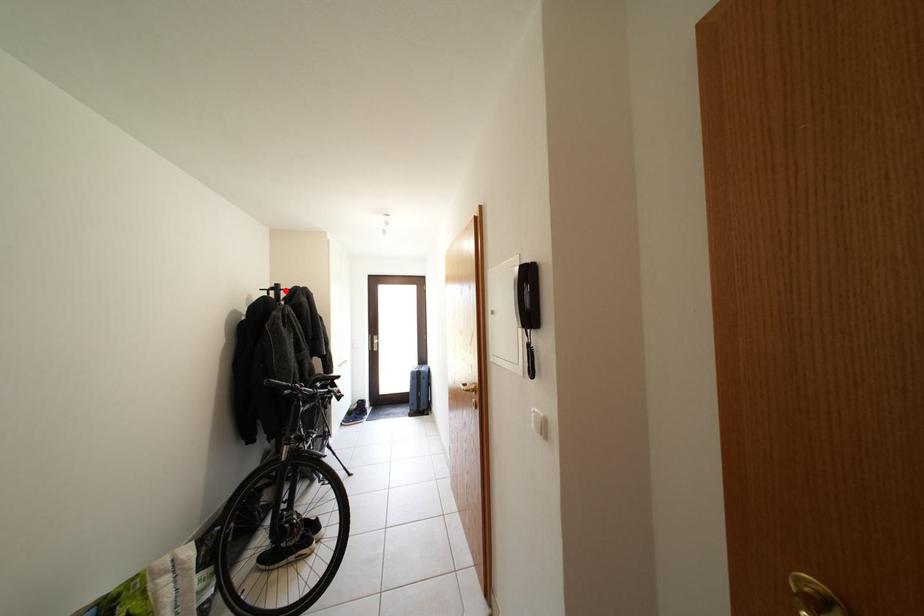
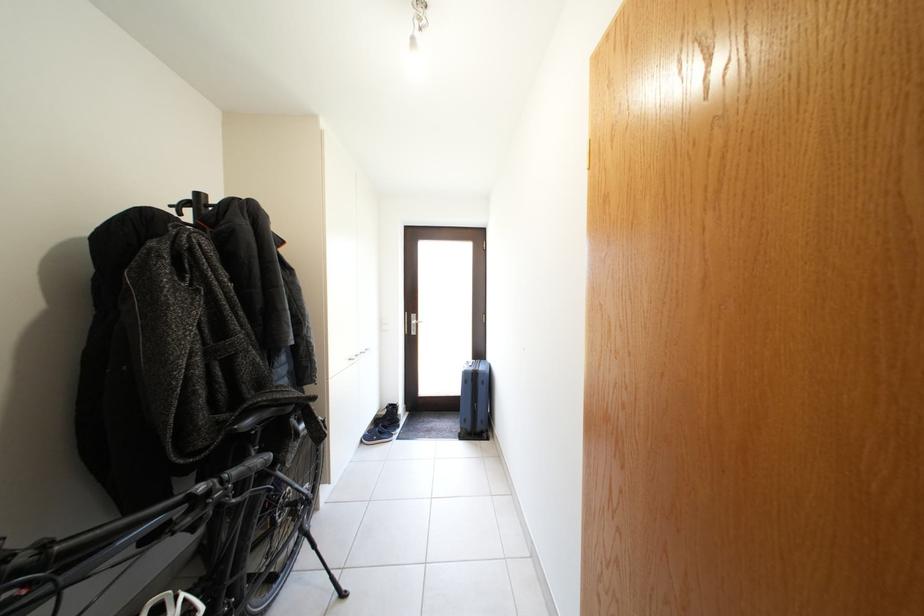
The point at the highlighted location is marked in the first image. Where is the corresponding point in the second image?

(205, 200)